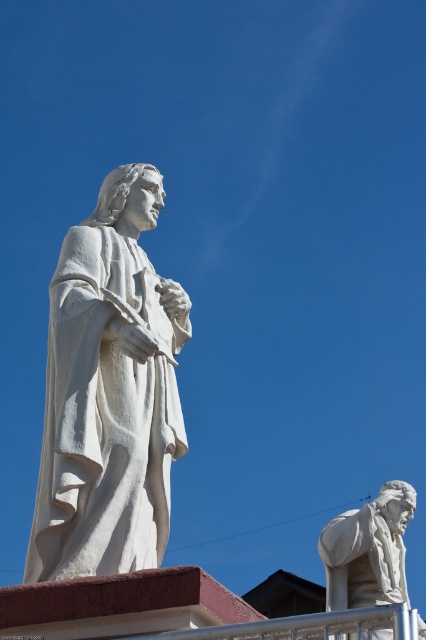
Question: Observing the image, what is the correct spatial positioning of white marble statue at left in reference to white marble statue at lower right?

Choices:
 (A) above
 (B) below

Answer: (A)

Question: Is white marble statue at left further to camera compared to white marble statue at lower right?

Choices:
 (A) yes
 (B) no

Answer: (A)

Question: Which object appears farthest from the camera in this image?

Choices:
 (A) white marble statue at lower right
 (B) white marble statue at left

Answer: (B)

Question: Can you confirm if white marble statue at left is thinner than white marble statue at lower right?

Choices:
 (A) no
 (B) yes

Answer: (B)

Question: Which point is farther from the camera taking this photo?

Choices:
 (A) (342, 566)
 (B) (89, 419)

Answer: (A)